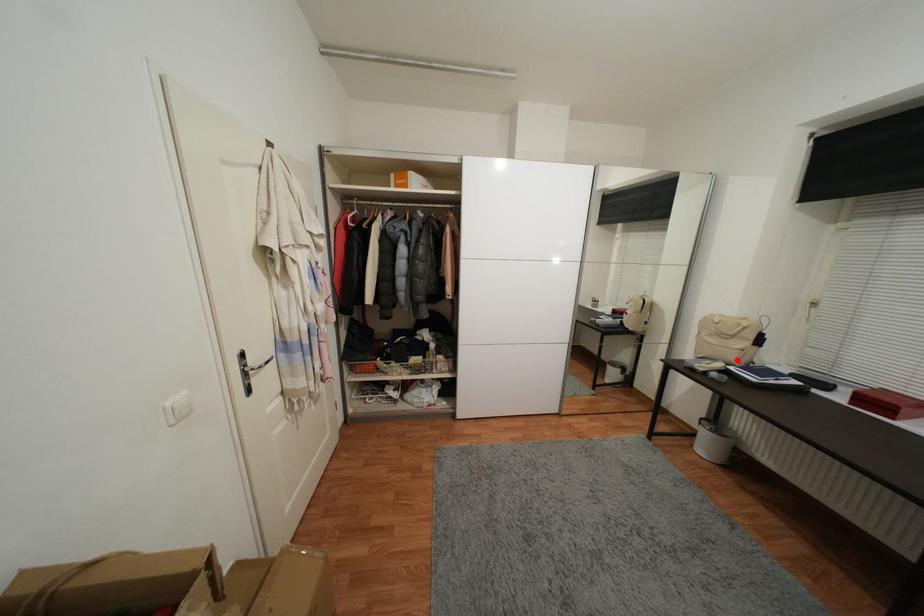
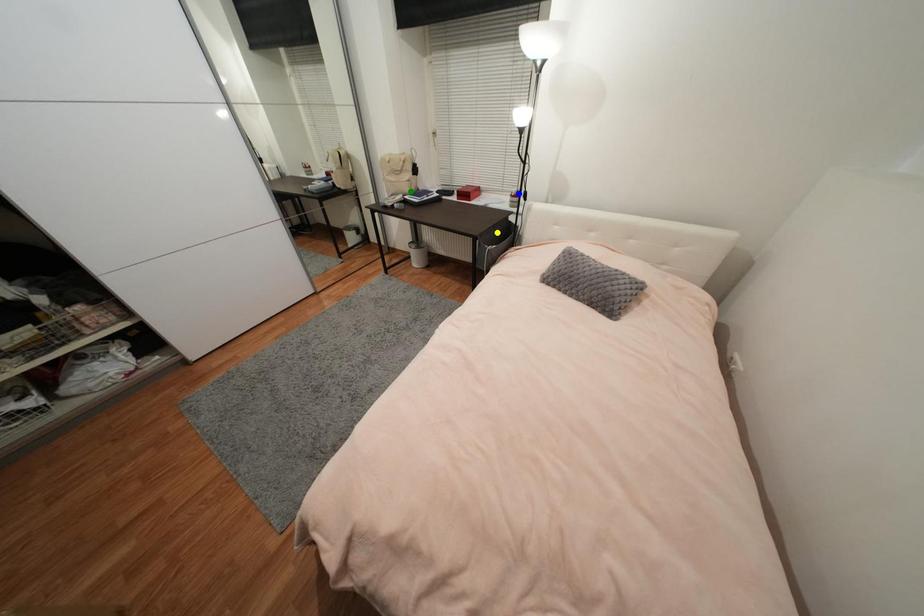
Question: I am providing you with two images of the same scene from different viewpoints. A red point is marked on the first image. You are given multiple points on the second image. Which spot in image 2 lines up with the point in image 1?

Choices:
 (A) yellow point
 (B) blue point
 (C) green point

Answer: (C)